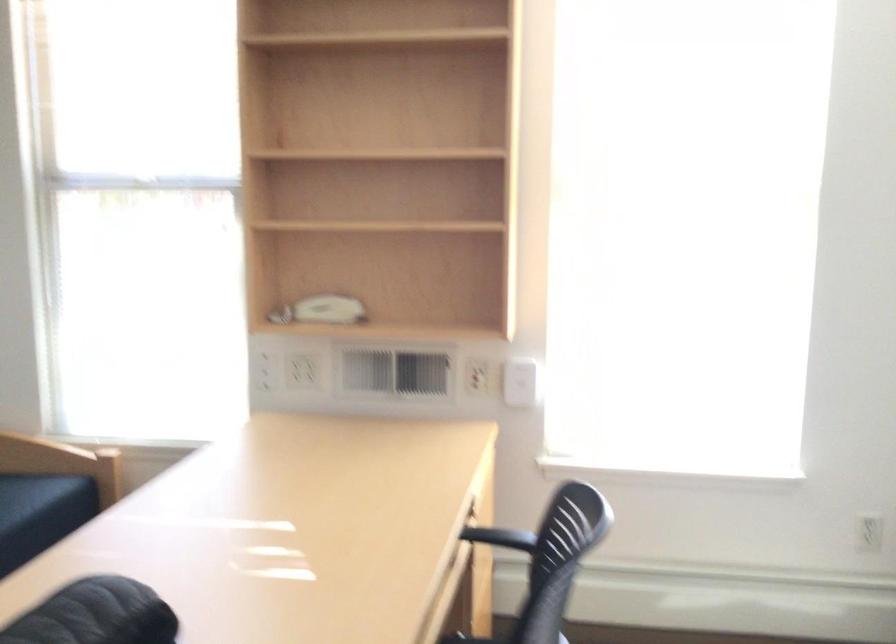
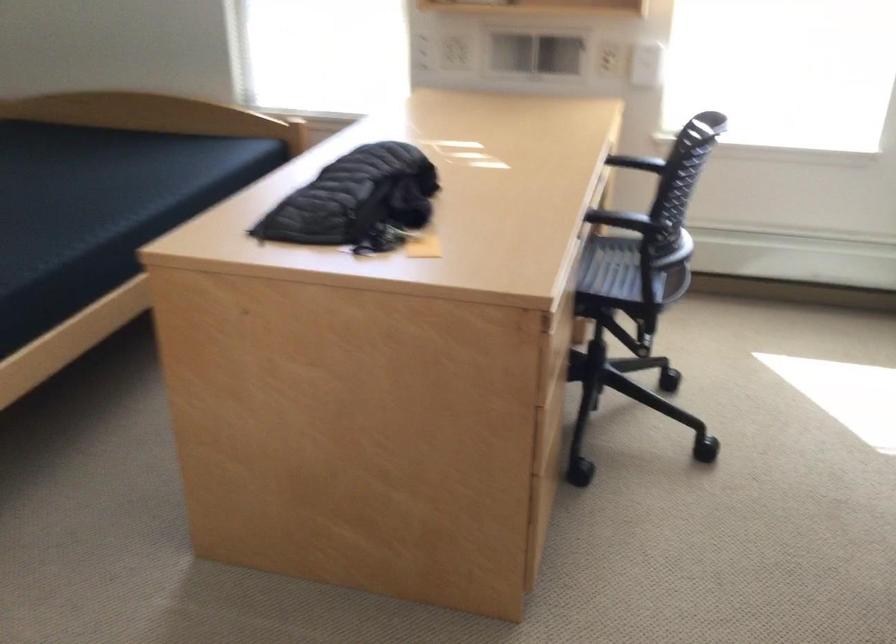
Question: I am providing you with two images of the same scene from different viewpoints. Please identify which objects are invisible in image2.

Choices:
 (A) white light switch
 (B) chair sitting surface
 (C) folded drying rack
 (D) black chair armrest

Answer: (D)